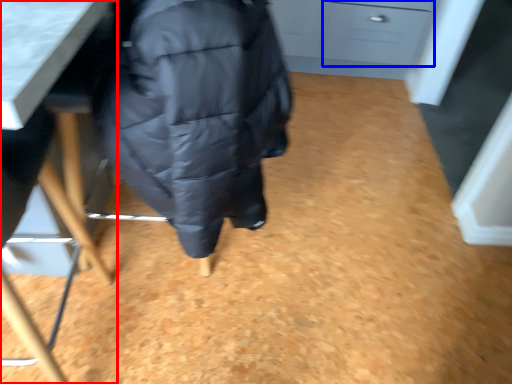
Question: Which of the following is the farthest to the observer, furniture (highlighted by a red box) or drawer (highlighted by a blue box)?

Choices:
 (A) furniture
 (B) drawer

Answer: (B)